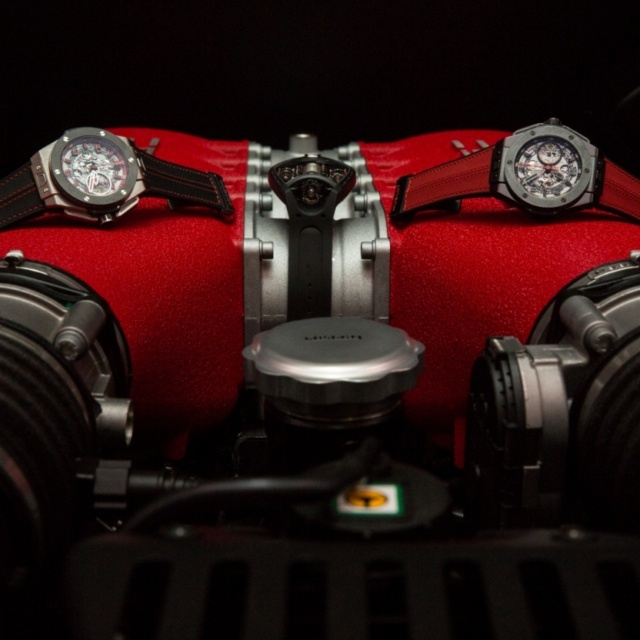
Which is above, leather strap at upper center or satin silver watch at upper right?

Positioned higher is satin silver watch at upper right.

Is leather strap at upper center below satin silver watch at upper right?

Yes, leather strap at upper center is below satin silver watch at upper right.

Is point (452, 168) closer to camera compared to point (589, 198)?

That is False.

Find the location of `leather strap at upper center`. leather strap at upper center is located at coordinates (524, 177).

Does point (598, 188) come behind point (65, 198)?

That is True.

Which is behind, point (557, 147) or point (56, 154)?

The point (557, 147) is more distant.

In order to click on satin silver watch at upper right in this screenshot , I will do pyautogui.click(x=547, y=168).

Does leather strap at upper center appear under black leather strap at left?

No.

Is leather strap at upper center shorter than black leather strap at left?

In fact, leather strap at upper center may be taller than black leather strap at left.

Does point (422, 192) come in front of point (134, 200)?

No, it is not.

You are a GUI agent. You are given a task and a screenshot of the screen. Output one action in this format:
    pyautogui.click(x=<x>, y=<y>)
    Task: Click on the leather strap at upper center
    This screenshot has width=640, height=640.
    Given the screenshot: What is the action you would take?
    pyautogui.click(x=524, y=177)